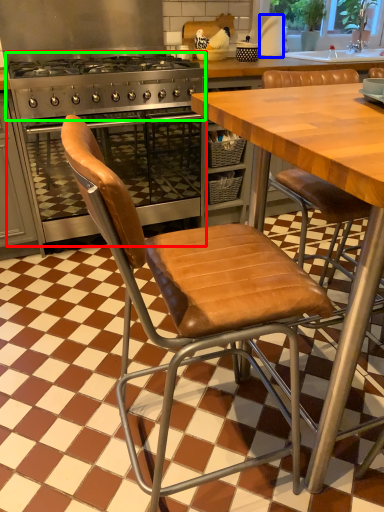
Question: Estimate the real-world distances between objects in this image. Which object is farther from kitchen appliance (highlighted by a red box), paper towel (highlighted by a blue box) or gas stove (highlighted by a green box)?

Choices:
 (A) paper towel
 (B) gas stove

Answer: (A)